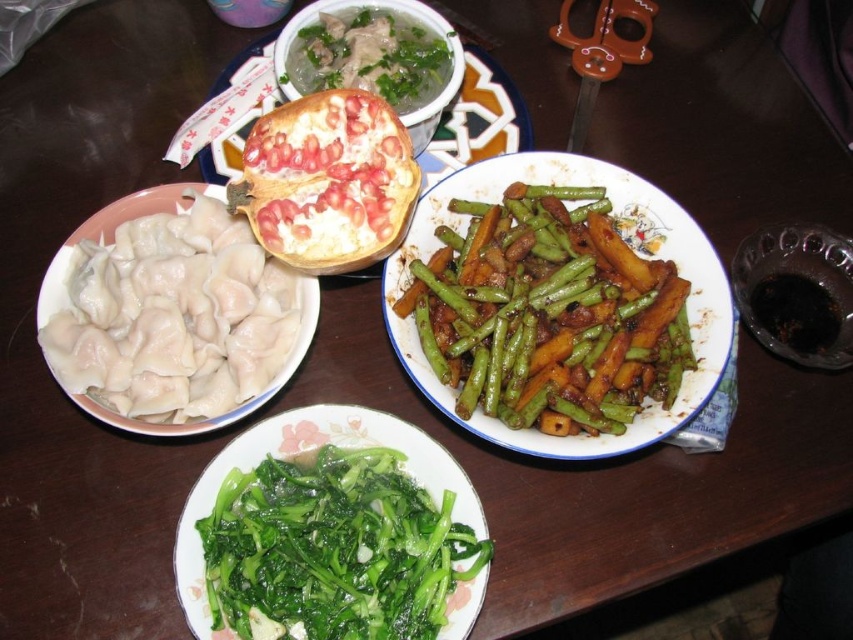
Which of these two, white dumplings at left or pomegranate seeds at center, stands shorter?

With less height is pomegranate seeds at center.

Does white dumplings at left come behind pomegranate seeds at center?

That is False.

Who is more distant from viewer, (183, 301) or (322, 115)?

Point (322, 115)

Locate an element on the screen. This screenshot has height=640, width=853. white dumplings at left is located at coordinates (171, 314).

Does green leafy vegetables at bottom have a lesser height compared to pomegranate seeds at center?

Correct, green leafy vegetables at bottom is not as tall as pomegranate seeds at center.

Who is positioned more to the left, green leafy vegetables at bottom or pomegranate seeds at center?

From the viewer's perspective, pomegranate seeds at center appears more on the left side.

Is point (341, 600) positioned before point (389, 189)?

Yes, it is in front of point (389, 189).

This screenshot has height=640, width=853. Find the location of `green leafy vegetables at bottom`. green leafy vegetables at bottom is located at coordinates (335, 548).

Who is shorter, green glossy string beans at center right or green leafy vegetables at center?

With less height is green leafy vegetables at center.

Can you confirm if green glossy string beans at center right is wider than green leafy vegetables at center?

Correct, the width of green glossy string beans at center right exceeds that of green leafy vegetables at center.

Based on the photo, who is more forward, (x=636, y=404) or (x=351, y=4)?

Point (x=636, y=404)

Locate an element on the screen. green glossy string beans at center right is located at coordinates (548, 314).